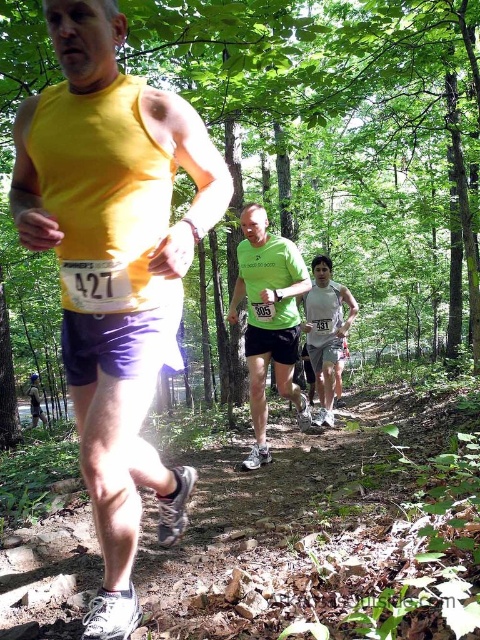
Who is shorter, green matte shirt at center or white mesh tank top at center?

With less height is white mesh tank top at center.

Where is `green matte shirt at center`? This screenshot has height=640, width=480. green matte shirt at center is located at coordinates (268, 320).

The image size is (480, 640). Describe the element at coordinates (268, 320) in the screenshot. I see `green matte shirt at center` at that location.

The width and height of the screenshot is (480, 640). I want to click on green matte shirt at center, so click(268, 320).

Does matte yellow tank top at center appear on the left side of white mesh tank top at center?

Correct, you'll find matte yellow tank top at center to the left of white mesh tank top at center.

Can you confirm if matte yellow tank top at center is smaller than white mesh tank top at center?

Correct, matte yellow tank top at center occupies less space than white mesh tank top at center.

Is point (127, 99) less distant than point (313, 275)?

Yes, point (127, 99) is closer to viewer.

You are a GUI agent. You are given a task and a screenshot of the screen. Output one action in this format:
    pyautogui.click(x=<x>, y=<y>)
    Task: Click on the matte yellow tank top at center
    The image size is (480, 640).
    Given the screenshot: What is the action you would take?
    pyautogui.click(x=113, y=268)

Who is lower down, matte yellow tank top at center or green matte shirt at center?

green matte shirt at center is below.

Is point (103, 353) positioned in front of point (297, 316)?

Yes, point (103, 353) is in front of point (297, 316).

Where is `matte yellow tank top at center`? Image resolution: width=480 pixels, height=640 pixels. matte yellow tank top at center is located at coordinates point(113,268).